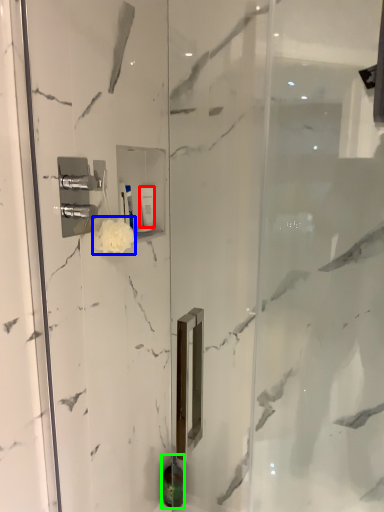
Question: Which object is positioned closest to toiletry (highlighted by a red box)? Select from flower (highlighted by a blue box) and toiletry (highlighted by a green box).

Choices:
 (A) flower
 (B) toiletry

Answer: (A)